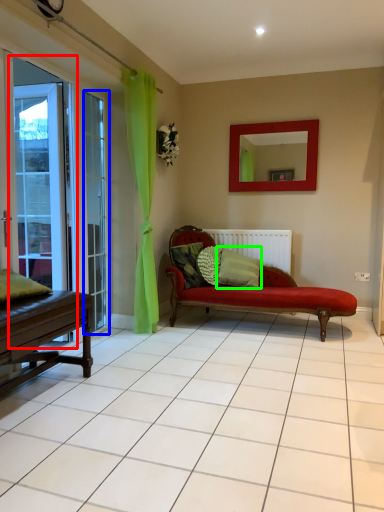
Question: Based on their relative distances, which object is nearer to screen door (highlighted by a red box)? Choose from window (highlighted by a blue box) and pillow (highlighted by a green box).

Choices:
 (A) window
 (B) pillow

Answer: (A)